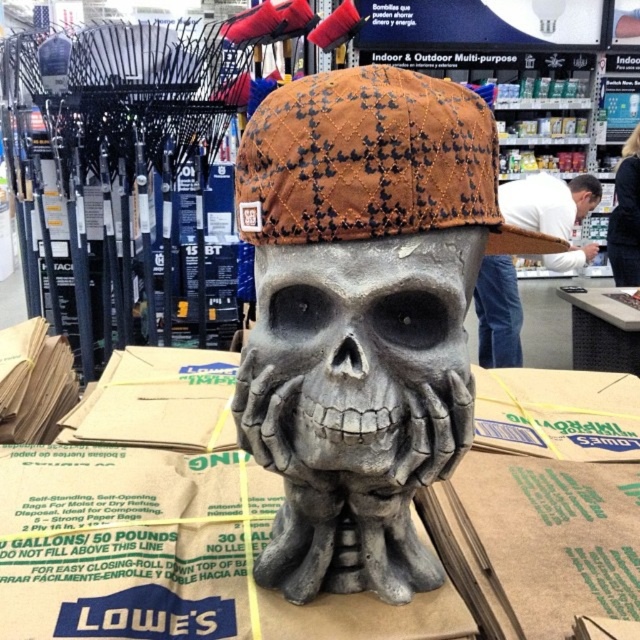
Question: Which of the following is the closest to the observer?

Choices:
 (A) (380, 428)
 (B) (292, 195)
 (C) (589, 202)
 (D) (634, 188)

Answer: (B)

Question: Can you confirm if matte brown fabric skull at center is bigger than white shirt at upper center?

Choices:
 (A) yes
 (B) no

Answer: (B)

Question: Is the position of brown quilted fabric baseball cap at center less distant than that of white shirt at upper center?

Choices:
 (A) yes
 (B) no

Answer: (A)

Question: Which point appears closest to the camera in this image?

Choices:
 (A) (333, 352)
 (B) (636, 193)

Answer: (A)

Question: Which point is farther from the camera taking this photo?

Choices:
 (A) (285, 115)
 (B) (355, 300)
 (C) (240, 172)
 (D) (612, 237)

Answer: (D)

Question: Can you confirm if white shirt at upper center is thinner than matte brown cap at upper center?

Choices:
 (A) yes
 (B) no

Answer: (B)